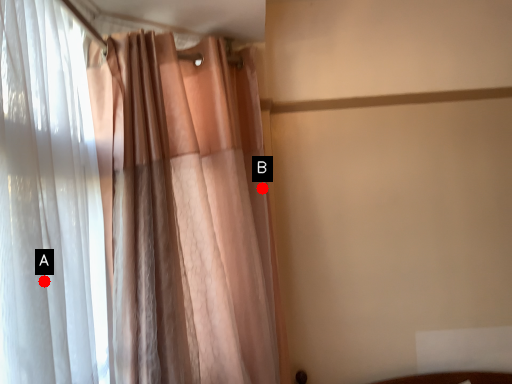
Question: Two points are circled on the image, labeled by A and B beside each circle. Which point appears closest to the camera in this image?

Choices:
 (A) A is closer
 (B) B is closer

Answer: (A)